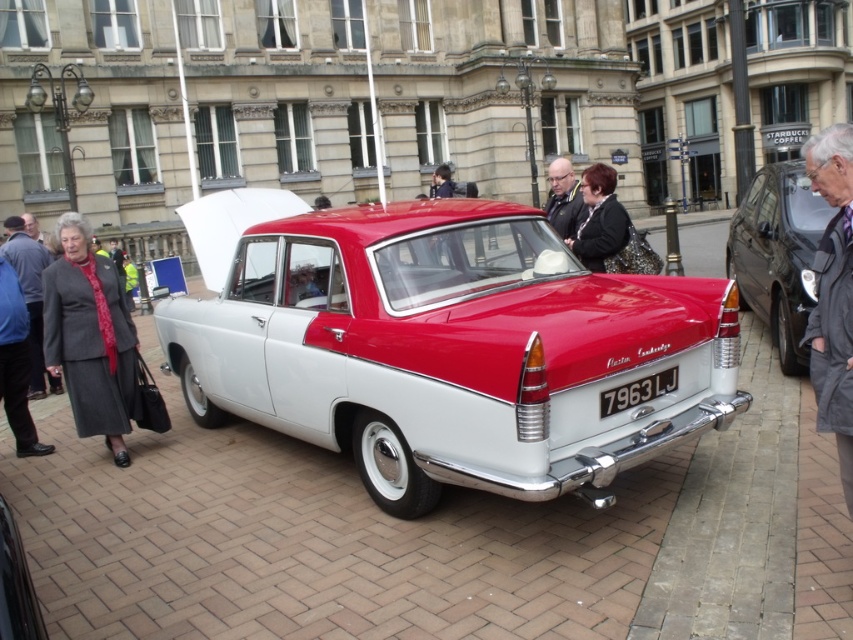
Question: Which of these objects is positioned closest to the black leather jacket at center?

Choices:
 (A) gray woolen suit at lower left
 (B) shiny black car at center

Answer: (A)

Question: Can you confirm if gray woolen suit at lower left is smaller than gray wool coat at lower left?

Choices:
 (A) no
 (B) yes

Answer: (B)

Question: Which point appears closest to the camera in this image?

Choices:
 (A) [106, 424]
 (B) [587, 230]

Answer: (A)

Question: Does black leather jacket at center appear on the right side of gray wool coat at lower left?

Choices:
 (A) no
 (B) yes

Answer: (B)

Question: Which of the following is the closest to the observer?

Choices:
 (A) gray woolen suit at lower left
 (B) dark gray uniform at center
 (C) shiny black car at center

Answer: (C)

Question: Does shiny black sedan at right have a lesser width compared to dark gray uniform at center?

Choices:
 (A) no
 (B) yes

Answer: (B)